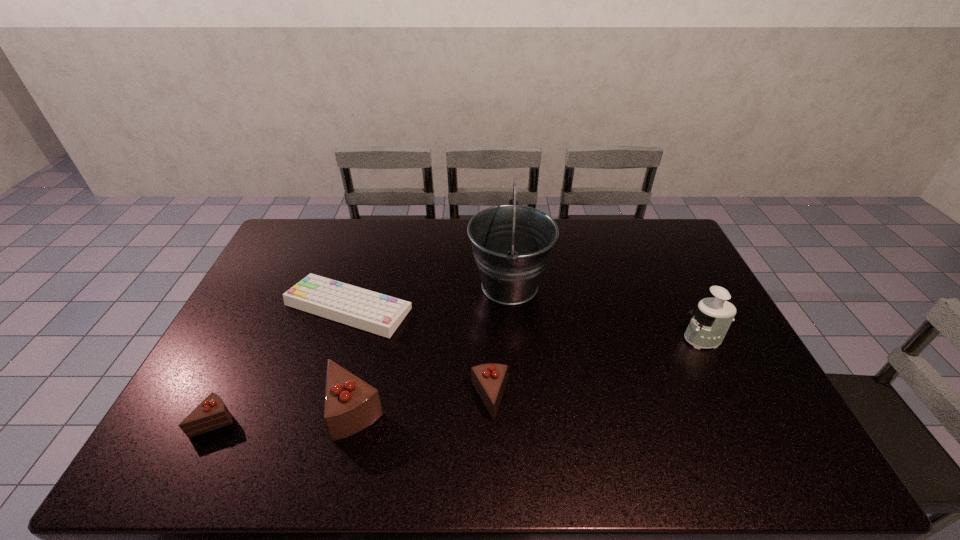
This screenshot has width=960, height=540. In the image, there is a desktop. In order to click on vacant space at the far edge in this screenshot , I will do `click(346, 251)`.

Image resolution: width=960 pixels, height=540 pixels. In the image, there is a desktop. In order to click on vacant space at the near edge in this screenshot , I will do `click(285, 416)`.

Find the location of a particular element. The image size is (960, 540). vacant area at the left edge of the desktop is located at coordinates (261, 346).

The width and height of the screenshot is (960, 540). Identify the location of vacant area at the far right corner. (659, 253).

Locate an element on the screen. This screenshot has height=540, width=960. vacant space at the near right corner of the desktop is located at coordinates (734, 414).

In order to click on free spot between the shortest chocolate cake and the second chocolate cake from left to right in this screenshot , I will do `click(285, 416)`.

You are a GUI agent. You are given a task and a screenshot of the screen. Output one action in this format:
    pyautogui.click(x=<x>, y=<y>)
    Task: Click on the free space between the leftmost chocolate cake and the second chocolate cake from right to left
    Image resolution: width=960 pixels, height=540 pixels.
    Given the screenshot: What is the action you would take?
    pyautogui.click(x=285, y=416)

Where is `vacant space that is in between the leftmost chocolate cake and the second chocolate cake from left to right`? The height and width of the screenshot is (540, 960). vacant space that is in between the leftmost chocolate cake and the second chocolate cake from left to right is located at coordinates (285, 416).

You are a GUI agent. You are given a task and a screenshot of the screen. Output one action in this format:
    pyautogui.click(x=<x>, y=<y>)
    Task: Click on the free space between the juicer and the rightmost chocolate cake
    
    Given the screenshot: What is the action you would take?
    pyautogui.click(x=596, y=369)

You are a GUI agent. You are given a task and a screenshot of the screen. Output one action in this format:
    pyautogui.click(x=<x>, y=<y>)
    Task: Click on the free space that is in between the shortest object and the juicer
    This screenshot has height=540, width=960.
    Given the screenshot: What is the action you would take?
    pyautogui.click(x=525, y=323)